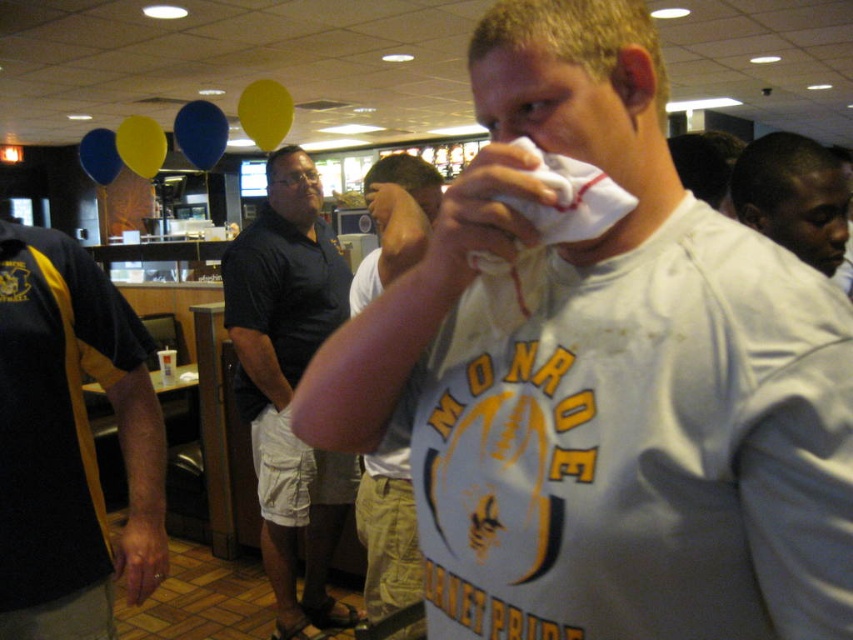
Is black fabric apron at left positioned behind dark blue polo shirt at center?

No, it is not.

Does black fabric apron at left have a smaller size compared to dark blue polo shirt at center?

Indeed, black fabric apron at left has a smaller size compared to dark blue polo shirt at center.

Find the location of a particular element. Image resolution: width=853 pixels, height=640 pixels. black fabric apron at left is located at coordinates (68, 442).

Does white cotton shirt at center lie behind dark blue polo shirt at center?

No, white cotton shirt at center is closer to the viewer.

Does white cotton shirt at center have a greater width compared to dark blue polo shirt at center?

In fact, white cotton shirt at center might be narrower than dark blue polo shirt at center.

Describe the element at coordinates (607, 380) in the screenshot. I see `white cotton shirt at center` at that location.

Image resolution: width=853 pixels, height=640 pixels. In order to click on white cotton shirt at center in this screenshot , I will do `click(607, 380)`.

Consider the image. Does white cotton shirt at center have a greater height compared to black fabric apron at left?

Incorrect, white cotton shirt at center's height is not larger of black fabric apron at left's.

Between white cotton shirt at center and black fabric apron at left, which one appears on the right side from the viewer's perspective?

white cotton shirt at center

In order to click on white cotton shirt at center in this screenshot , I will do pos(607,380).